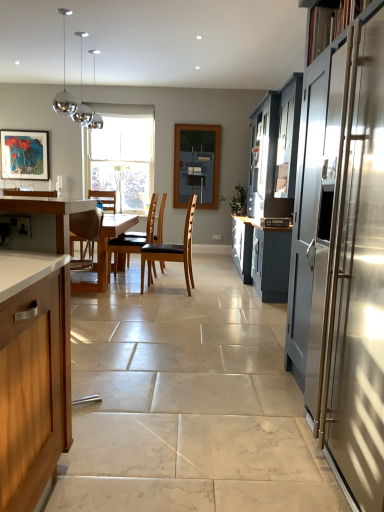
Question: Which direction should I rotate to look at brown leather chair at center, which is counted as the first chair, starting from the front, — up or down?

Choices:
 (A) down
 (B) up

Answer: (B)

Question: From the image's perspective, would you say matte wooden picture frame at upper left is shown under brown leather chair at center, which is counted as the 2th chair, starting from the back?

Choices:
 (A) yes
 (B) no

Answer: (B)

Question: Are matte wooden picture frame at upper left and brown leather chair at center, which is counted as the first chair, starting from the front, far apart?

Choices:
 (A) no
 (B) yes

Answer: (B)

Question: Considering the relative sizes of matte wooden picture frame at upper left and brown leather chair at center, which is counted as the 2th chair, starting from the back, in the image provided, is matte wooden picture frame at upper left wider than brown leather chair at center, which is counted as the 2th chair, starting from the back,?

Choices:
 (A) yes
 (B) no

Answer: (B)

Question: Is matte wooden picture frame at upper left completely or partially outside of brown leather chair at center, the 1th chair from the right?

Choices:
 (A) no
 (B) yes

Answer: (B)

Question: Can you confirm if matte wooden picture frame at upper left is shorter than brown leather chair at center, which is counted as the 2th chair, starting from the back?

Choices:
 (A) no
 (B) yes

Answer: (B)

Question: From a real-world perspective, is matte wooden picture frame at upper left positioned under brown leather chair at center, which is counted as the first chair, starting from the front, based on gravity?

Choices:
 (A) yes
 (B) no

Answer: (B)

Question: Does matte blue cabinet at right, placed as the third cabinetry when sorted from front to back, have a lesser height compared to wooden countertop at left, positioned as the 3th cabinetry in right-to-left order?

Choices:
 (A) no
 (B) yes

Answer: (A)

Question: Would you consider matte blue cabinet at right, the 1th cabinetry from the back, to be distant from wooden countertop at left, which ranks as the 2th cabinetry in back-to-front order?

Choices:
 (A) yes
 (B) no

Answer: (A)

Question: Can you confirm if matte blue cabinet at right, acting as the first cabinetry starting from the right, is smaller than wooden countertop at left, positioned as the 3th cabinetry in right-to-left order?

Choices:
 (A) yes
 (B) no

Answer: (B)

Question: From a real-world perspective, is matte blue cabinet at right, placed as the third cabinetry when sorted from front to back, on wooden countertop at left, which ranks as the 2th cabinetry in back-to-front order?

Choices:
 (A) yes
 (B) no

Answer: (A)

Question: Is matte blue cabinet at right, the 1th cabinetry from the back, wider than wooden countertop at left, positioned as the 3th cabinetry in right-to-left order?

Choices:
 (A) no
 (B) yes

Answer: (B)

Question: Is matte blue cabinet at right, placed as the third cabinetry when sorted from front to back, aimed at wooden countertop at left, which ranks as the 2th cabinetry in back-to-front order?

Choices:
 (A) yes
 (B) no

Answer: (B)

Question: Would you say satin silver microwave at center contains brown leather chair at center, which is counted as the 1th chair, starting from the back?

Choices:
 (A) no
 (B) yes

Answer: (A)